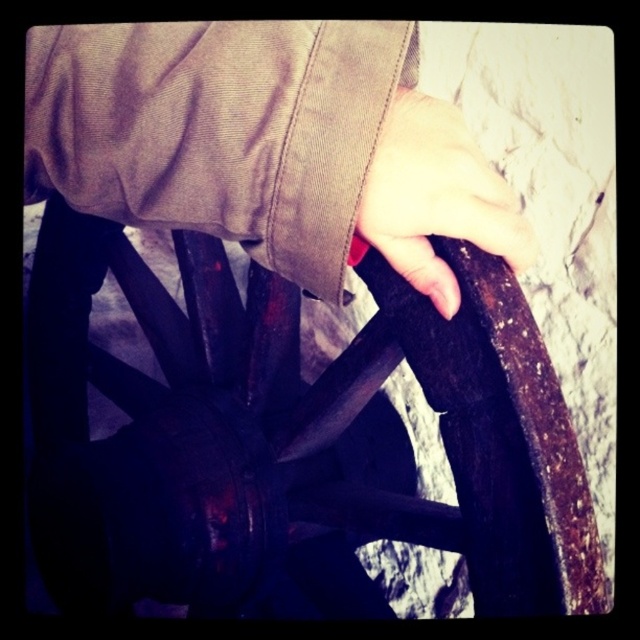
You are a mechanic trying to repair a wagon wheel. You have a tool that requires a minimum of 18 inches of clearance to operate. Can you use it between the rusty metal wagon wheel at center and the smooth skin hand at center?

The rusty metal wagon wheel at center and the smooth skin hand at center are 18.94 inches apart, which is just over the required 18 inches clearance. Therefore, the tool can be used between them.

You are a photographer trying to capture a detailed closeup of the rusty metal wagon wheel at center. Your camera has a minimum focusing distance of 18 inches. Will you be able to take the photo without moving closer than the camera allows?

The rusty metal wagon wheel at center is 20.61 inches away from camera. Since the camera can focus as close as 18 inches, you can take the photo without moving closer because the distance is within the camera s minimum focusing range.

You are a photographer trying to capture the texture details of both the brown suede jacket at upper center and the smooth skin hand at center. Since the background is blurred, which object would you focus on first to ensure sharpness in your photo?

The brown suede jacket at upper center is closer to the viewer than the smooth skin hand at center, so focusing on the brown suede jacket at upper center first would ensure its sharpness while the hand may appear slightly blurred. To capture both sharply, you might need to adjust focus or use a smaller aperture for greater depth of field.